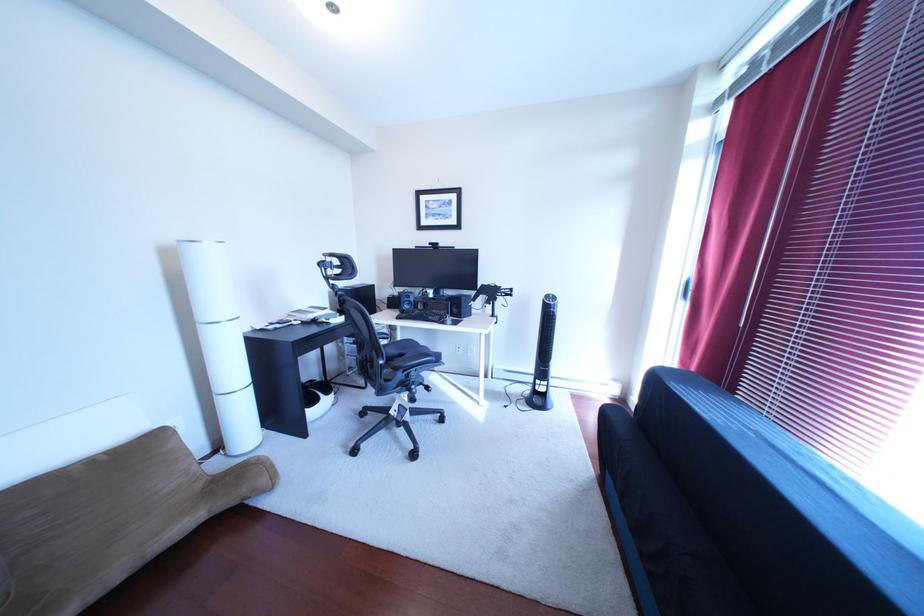
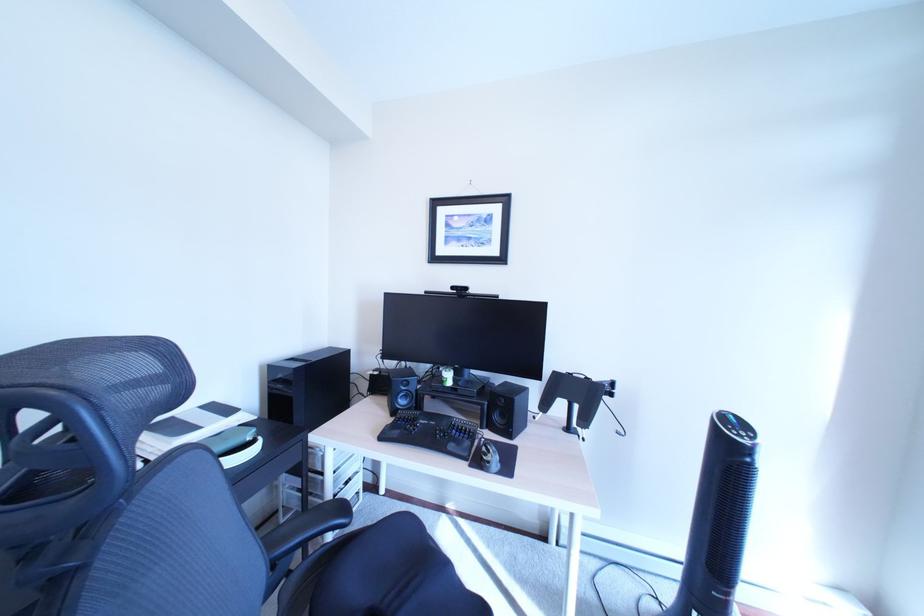
Question: In a continuous first-person perspective shot, in which direction is the camera moving?

Choices:
 (A) Left
 (B) Right
 (C) Forward
 (D) Backward

Answer: (C)